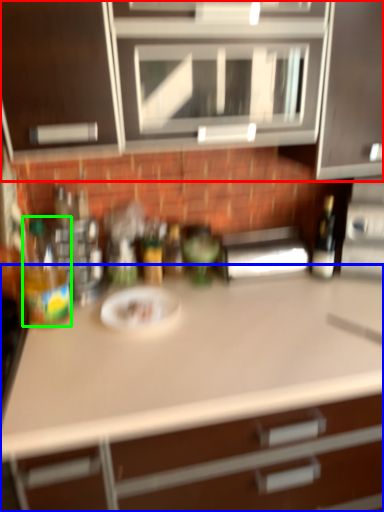
Question: Which object is the farthest from cabinetry (highlighted by a red box)? Choose among these: countertop (highlighted by a blue box) or bottle (highlighted by a green box).

Choices:
 (A) countertop
 (B) bottle

Answer: (A)